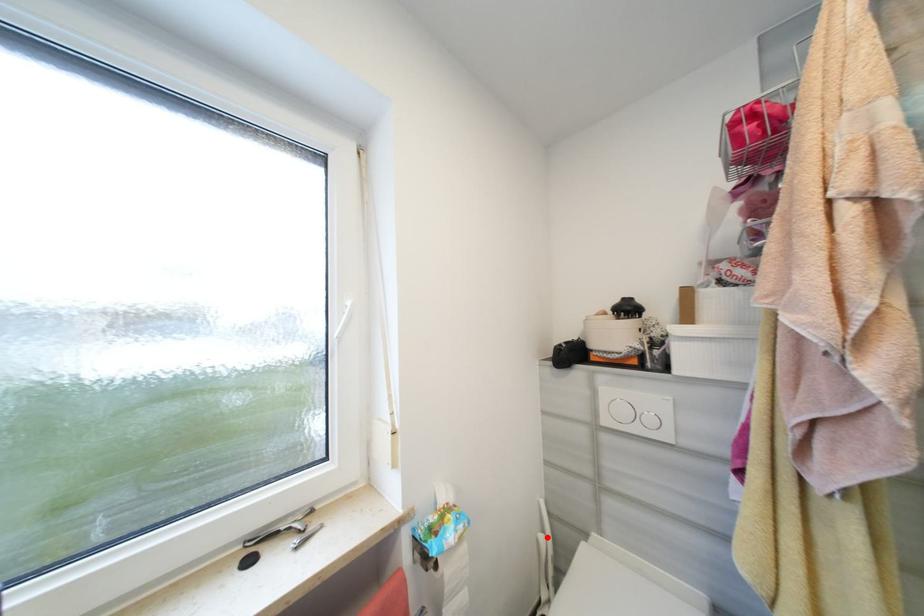
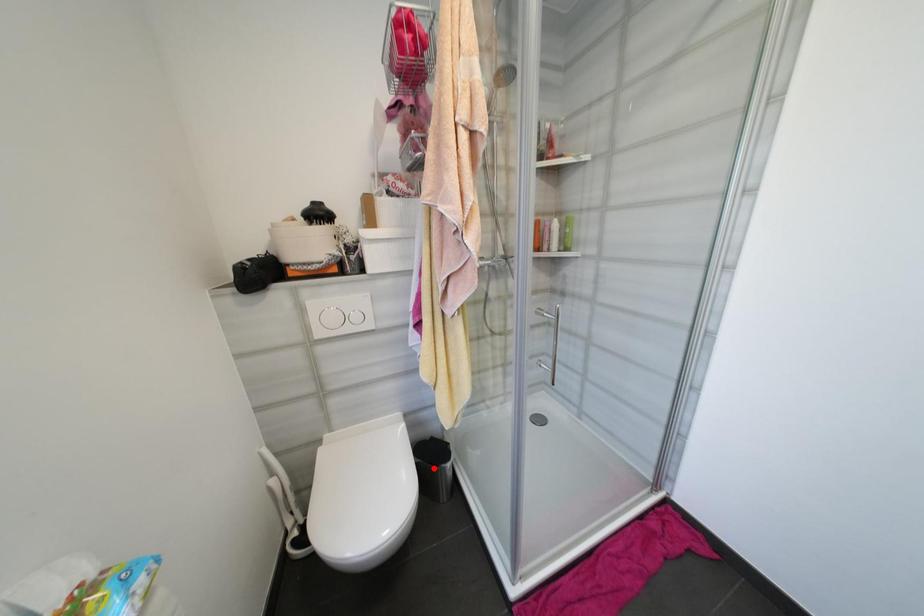
I am providing you with two images of the same scene from different viewpoints. A red point is marked on the first image and another point is marked on the second image. Do the highlighted points in image1 and image2 indicate the same real-world spot?

No